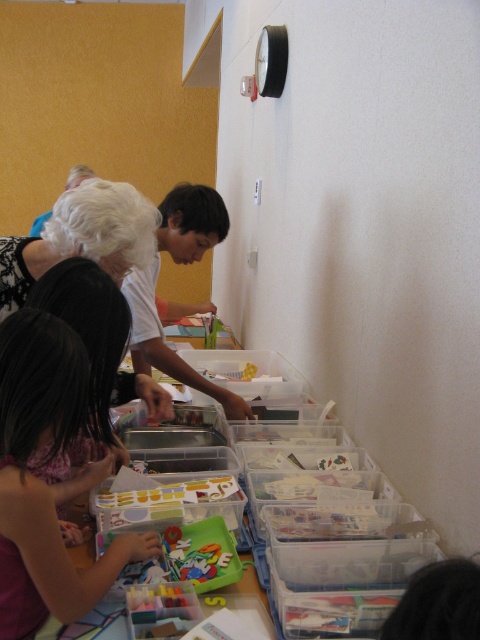
Question: Which point is closer to the camera taking this photo?

Choices:
 (A) (39, 445)
 (B) (21, 291)

Answer: (A)

Question: Can you confirm if matte pink dress at lower left is thinner than white lace dress at upper left?

Choices:
 (A) no
 (B) yes

Answer: (B)

Question: Where is matte pink dress at lower left located in relation to white lace dress at upper left in the image?

Choices:
 (A) right
 (B) left

Answer: (A)

Question: Can you confirm if matte pink dress at lower left is positioned to the left of white lace dress at upper left?

Choices:
 (A) yes
 (B) no

Answer: (B)

Question: Among these points, which one is farthest from the camera?

Choices:
 (A) (40, 417)
 (B) (12, 278)

Answer: (B)